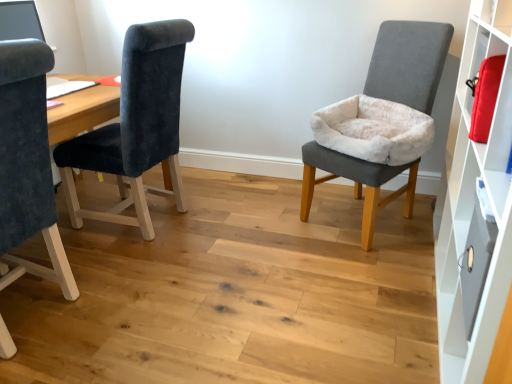
The image size is (512, 384). Find the location of `vacant space to the right of velvet dark blue chair at left, the second chair positioned from the left`. vacant space to the right of velvet dark blue chair at left, the second chair positioned from the left is located at coordinates (234, 216).